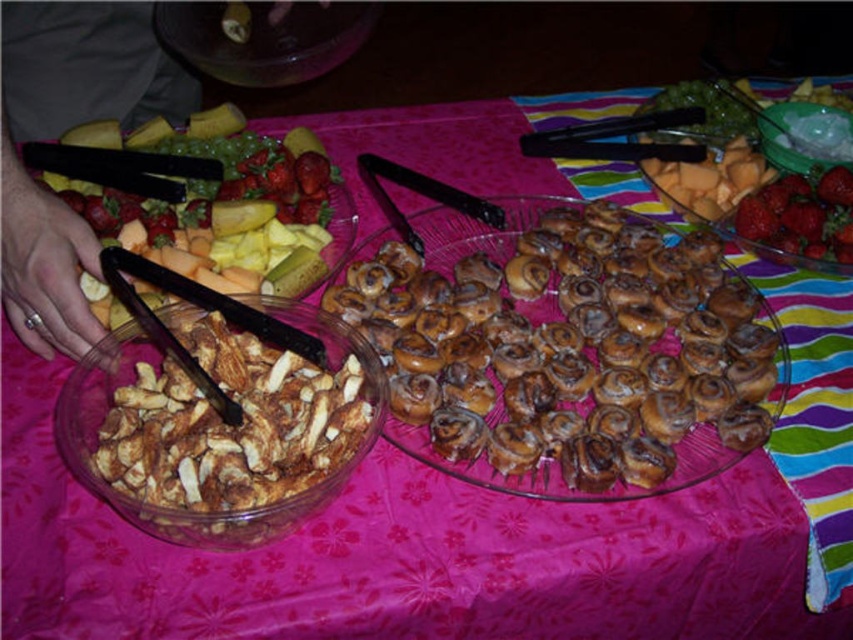
Does golden brown glazed pastry at center have a smaller size compared to red glossy strawberries at upper right?

Actually, golden brown glazed pastry at center might be larger than red glossy strawberries at upper right.

The image size is (853, 640). I want to click on golden brown glazed pastry at center, so [x=567, y=349].

At what (x,y) coordinates should I click in order to perform the action: click on golden brown glazed pastry at center. Please return your answer as a coordinate pair (x, y). This screenshot has width=853, height=640. Looking at the image, I should click on (567, 349).

Who is more distant from viewer, (628,324) or (229,356)?

The point (628,324) is behind.

Is point (566, 285) less distant than point (138, 336)?

No.

Locate an element on the screen. golden brown glazed pastry at center is located at coordinates (567, 349).

Find the location of a particular element. golden brown glazed pastry at center is located at coordinates (567, 349).

Does brown crumbly bread at lower left have a lesser height compared to red glossy strawberries at upper right?

In fact, brown crumbly bread at lower left may be taller than red glossy strawberries at upper right.

Can you confirm if brown crumbly bread at lower left is smaller than red glossy strawberries at upper right?

No.

Image resolution: width=853 pixels, height=640 pixels. Find the location of `brown crumbly bread at lower left`. brown crumbly bread at lower left is located at coordinates (227, 429).

Where is `brown crumbly bread at lower left`? The width and height of the screenshot is (853, 640). brown crumbly bread at lower left is located at coordinates (227, 429).